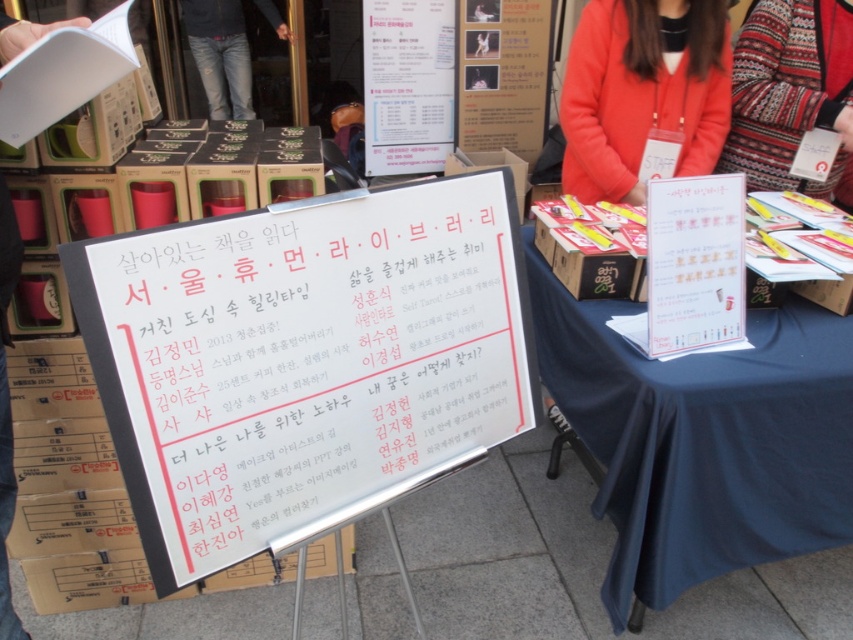
You are organizing an event and need to place a name tag on the white paperboard at center and the matte orange jacket at upper right. Which object has a wider surface to accommodate a larger name tag?

The white paperboard at center has a wider surface than the matte orange jacket at upper right, so it can accommodate a larger name tag.

You are at a book fair and want to take a photo of the whiteboard sign. There are two items in your way, the matte orange jacket at upper right and the knitted sweater at upper right. Which item is closer to you and should you move first?

The matte orange jacket at upper right is closer to the viewer than the knitted sweater at upper right, so you should move the matte orange jacket at upper right first to get a clear photo of the whiteboard sign.

You are at a book fair and see two items on the right side of the whiteboard sign. Which one is positioned to the left between the matte orange jacket at upper right and the knitted sweater at upper right?

The matte orange jacket at upper right is positioned to the left of the knitted sweater at upper right.